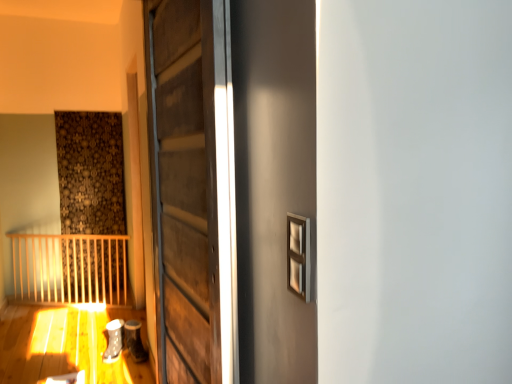
Question: From the image's perspective, does white matte shoe at lower left, acting as the first shoe starting from the left, appear lower than wooden door at center?

Choices:
 (A) yes
 (B) no

Answer: (A)

Question: From a real-world perspective, is white matte shoe at lower left, acting as the first shoe starting from the left, located beneath wooden door at center?

Choices:
 (A) yes
 (B) no

Answer: (A)

Question: Is white matte shoe at lower left, the 2th shoe positioned from the right, taller than wooden door at center?

Choices:
 (A) no
 (B) yes

Answer: (A)

Question: Is white matte shoe at lower left, the 2th shoe positioned from the right, facing towards wooden door at center?

Choices:
 (A) yes
 (B) no

Answer: (B)

Question: Is white matte shoe at lower left, the 2th shoe positioned from the right, wider than wooden door at center?

Choices:
 (A) no
 (B) yes

Answer: (B)

Question: Does white matte shoe at lower left, the 2th shoe positioned from the right, lie in front of wooden door at center?

Choices:
 (A) yes
 (B) no

Answer: (B)

Question: Does matte gray shoe at lower left, the 2th shoe in the left-to-right sequence, have a greater height compared to white matte shoe at lower left, acting as the first shoe starting from the left?

Choices:
 (A) yes
 (B) no

Answer: (A)

Question: From a real-world perspective, is matte gray shoe at lower left, the first shoe from the right, physically above white matte shoe at lower left, acting as the first shoe starting from the left?

Choices:
 (A) no
 (B) yes

Answer: (B)

Question: Can you confirm if matte gray shoe at lower left, the 2th shoe in the left-to-right sequence, is bigger than white matte shoe at lower left, acting as the first shoe starting from the left?

Choices:
 (A) yes
 (B) no

Answer: (A)

Question: From the image's perspective, would you say matte gray shoe at lower left, the first shoe from the right, is positioned over white matte shoe at lower left, the 2th shoe positioned from the right?

Choices:
 (A) no
 (B) yes

Answer: (B)

Question: Is matte gray shoe at lower left, the 2th shoe in the left-to-right sequence, at the right side of white matte shoe at lower left, acting as the first shoe starting from the left?

Choices:
 (A) yes
 (B) no

Answer: (A)

Question: Is matte gray shoe at lower left, the first shoe from the right, far from white matte shoe at lower left, the 2th shoe positioned from the right?

Choices:
 (A) no
 (B) yes

Answer: (A)

Question: Does wooden door at center appear on the right side of white matte shoe at lower left, the 2th shoe positioned from the right?

Choices:
 (A) no
 (B) yes

Answer: (B)